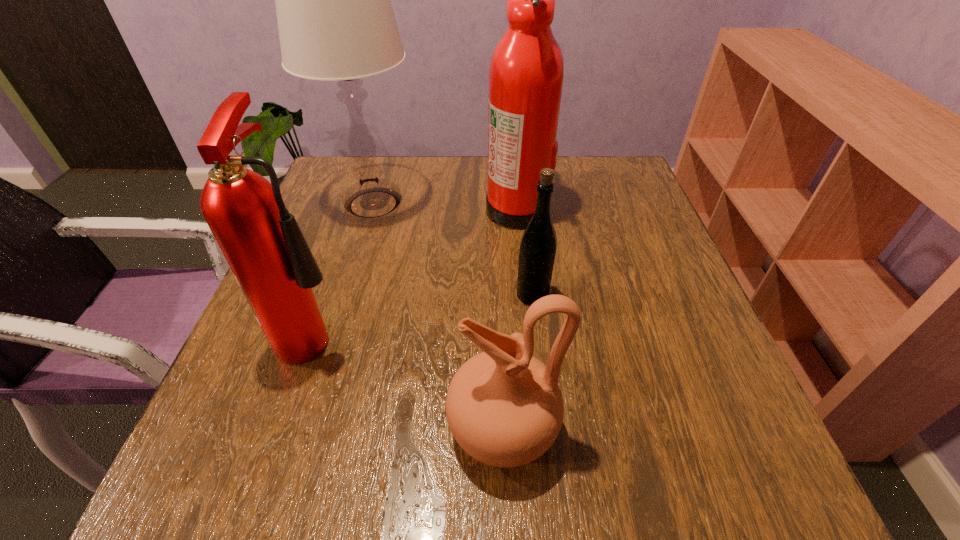
Where is `free spot located 0.120m on the front-facing side of the table lamp`? The image size is (960, 540). free spot located 0.120m on the front-facing side of the table lamp is located at coordinates (470, 204).

In order to click on free space located 0.300m at the nozzle of the shorter fire extinguisher in this screenshot , I will do `click(518, 330)`.

The height and width of the screenshot is (540, 960). I want to click on free location located on the right of the beer bottle, so click(x=628, y=295).

I want to click on free region located on the spout of the nearest object, so 240,429.

Where is `free space located 0.270m on the spout of the nearest object`? free space located 0.270m on the spout of the nearest object is located at coordinates (267, 429).

Where is `free space located 0.250m on the spout of the nearest object`? This screenshot has height=540, width=960. free space located 0.250m on the spout of the nearest object is located at coordinates (280, 429).

Where is `fire extinguisher located in the far edge section of the desktop`? This screenshot has width=960, height=540. fire extinguisher located in the far edge section of the desktop is located at coordinates (526, 72).

Locate an element on the screen. table lamp situated at the far edge is located at coordinates (335, 19).

Where is `object that is at the near edge`? This screenshot has height=540, width=960. object that is at the near edge is located at coordinates (504, 407).

Identify the location of table lamp situated at the left edge. This screenshot has width=960, height=540. (335, 19).